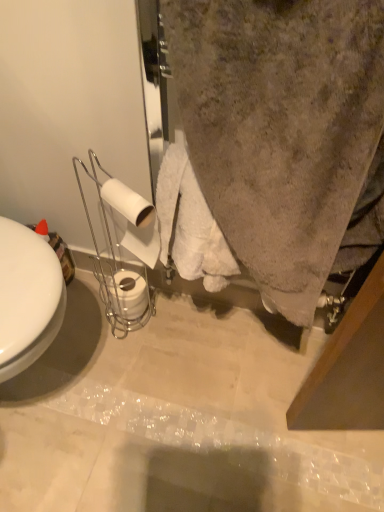
Where is `free spot to the right of white matte toilet paper at lower center, acting as the first toilet paper starting from the bottom`? free spot to the right of white matte toilet paper at lower center, acting as the first toilet paper starting from the bottom is located at coordinates (178, 318).